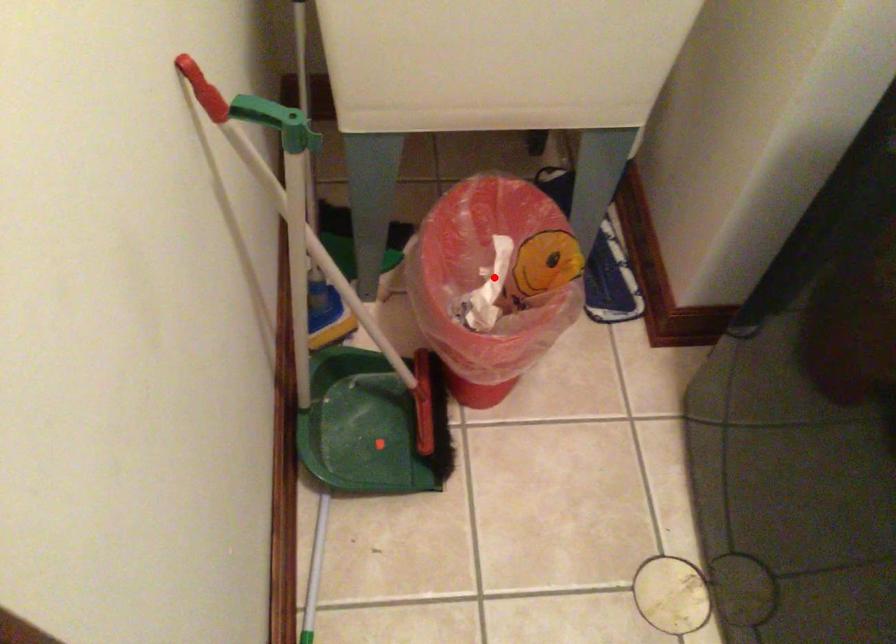
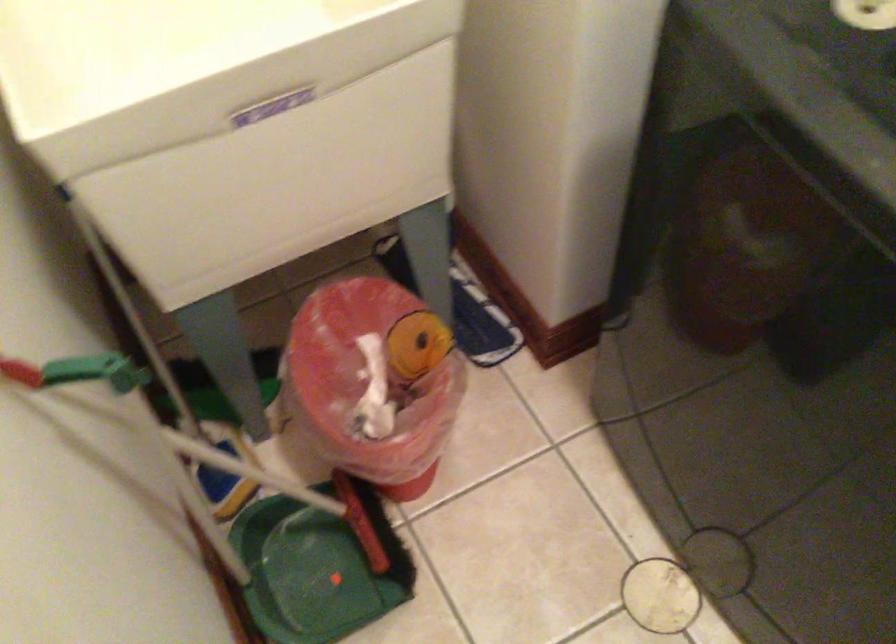
Locate, in the second image, the point that corresponds to the highlighted location in the first image.

(375, 377)